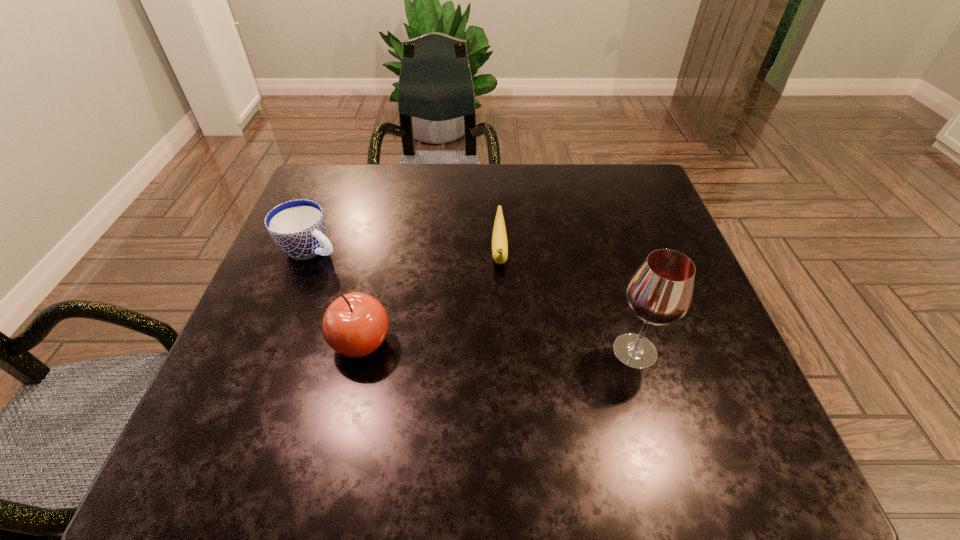
At what (x,y) coordinates should I click in order to perform the action: click on the second object from left to right. Please return your answer as a coordinate pair (x, y). The image size is (960, 540). Looking at the image, I should click on (354, 325).

This screenshot has width=960, height=540. I want to click on the third shortest object, so click(x=354, y=325).

Find the location of a particular element. the rightmost object is located at coordinates (660, 292).

What are the coordinates of `the tallest object` in the screenshot? It's located at (660, 292).

The width and height of the screenshot is (960, 540). In order to click on banana in this screenshot , I will do `click(499, 237)`.

Locate an element on the screen. This screenshot has height=540, width=960. cup is located at coordinates [298, 227].

Where is `vacant space located on the back of the third shortest object`? vacant space located on the back of the third shortest object is located at coordinates (390, 219).

You are a GUI agent. You are given a task and a screenshot of the screen. Output one action in this format:
    pyautogui.click(x=<x>, y=<y>)
    Task: Click on the vacant region located 0.200m on the left of the wineglass
    The height and width of the screenshot is (540, 960).
    Given the screenshot: What is the action you would take?
    pyautogui.click(x=505, y=351)

The width and height of the screenshot is (960, 540). Identify the location of vacant position located at the stem of the second object from right to left. (501, 305).

Locate an element on the screen. This screenshot has height=540, width=960. vacant space located 0.170m at the stem of the second object from right to left is located at coordinates (502, 347).